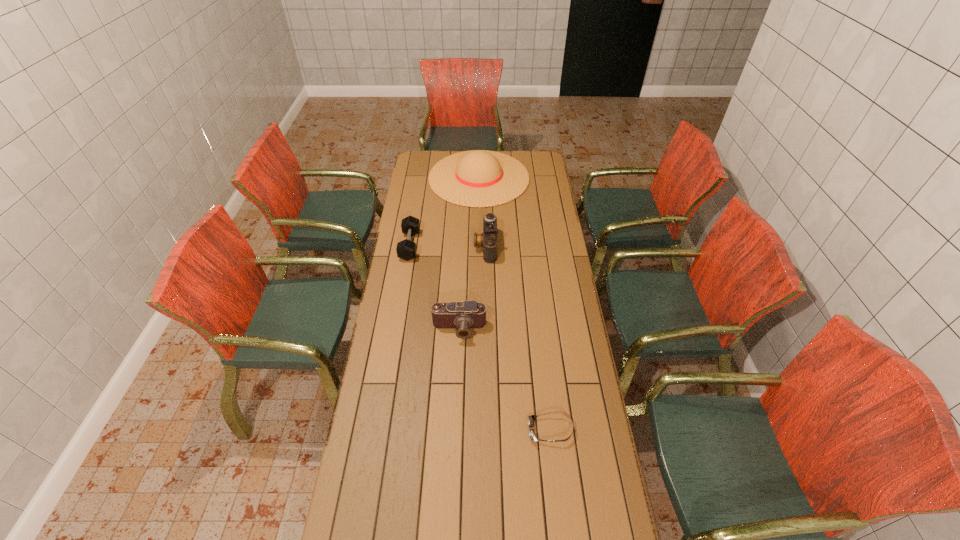
The width and height of the screenshot is (960, 540). I want to click on vacant point located 0.360m on the lens of the farther camera, so click(397, 246).

Find the location of a particular element. The image size is (960, 540). vacant space located 0.160m on the lens of the farther camera is located at coordinates (440, 246).

This screenshot has width=960, height=540. Identify the location of vacant space situated 0.390m on the front-facing side of the second nearest object. (454, 442).

At what (x,y) coordinates should I click in order to perform the action: click on vacant space located 0.220m on the front of the dumbbell. Please return your answer as a coordinate pair (x, y). Looking at the image, I should click on (401, 299).

I want to click on free spot located 0.320m on the front-facing side of the goggles, so click(431, 430).

At what (x,y) coordinates should I click in order to perform the action: click on vacant area situated on the front-facing side of the goggles. Please return your answer as a coordinate pair (x, y). The width and height of the screenshot is (960, 540). Looking at the image, I should click on (504, 430).

I want to click on vacant position located 0.050m on the front-facing side of the goggles, so click(514, 430).

Image resolution: width=960 pixels, height=540 pixels. Identify the location of object present at the far edge. (477, 178).

Where is `bonnet that is positioned at the left edge`? Image resolution: width=960 pixels, height=540 pixels. bonnet that is positioned at the left edge is located at coordinates (477, 178).

The width and height of the screenshot is (960, 540). Find the location of `dumbbell that is at the left edge`. dumbbell that is at the left edge is located at coordinates (406, 249).